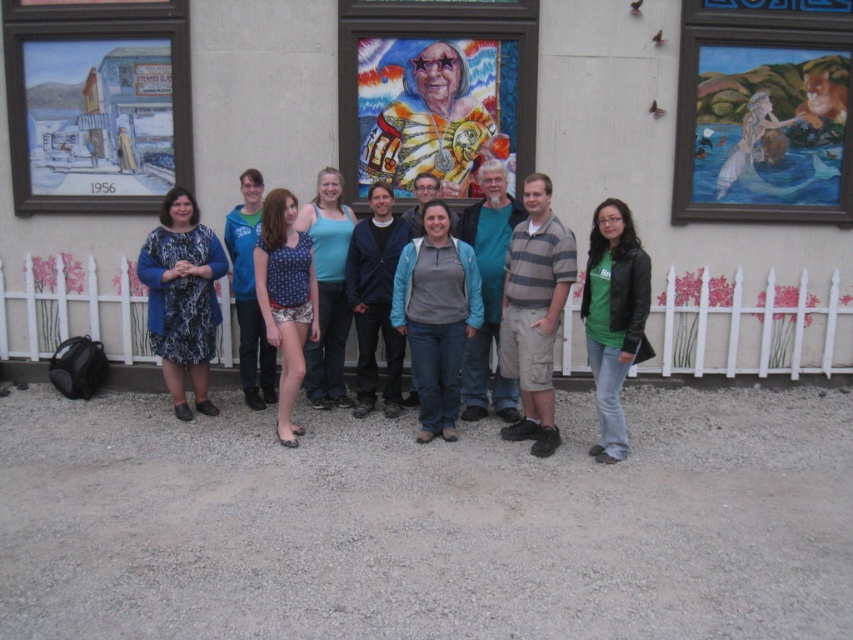
Looking at this image, is blue printed shorts at center below blue fabric tank top at center?

Indeed, blue printed shorts at center is positioned under blue fabric tank top at center.

Who is more distant from viewer, (283, 404) or (328, 268)?

Positioned behind is point (328, 268).

Identify the location of blue printed shorts at center. (285, 298).

Where is `blue printed shorts at center`? The height and width of the screenshot is (640, 853). blue printed shorts at center is located at coordinates (285, 298).

Is point (395, 320) positioned after point (332, 380)?

No, (395, 320) is in front of (332, 380).

Is matte gray sweater at center wider than blue fabric tank top at center?

Indeed, matte gray sweater at center has a greater width compared to blue fabric tank top at center.

Does point (428, 364) come closer to viewer compared to point (323, 236)?

Yes, point (428, 364) is in front of point (323, 236).

Locate an element on the screen. This screenshot has width=853, height=640. matte gray sweater at center is located at coordinates (436, 316).

Which is below, green matte jacket at lower right or blue fabric tank top at center?

Positioned lower is green matte jacket at lower right.

Does point (606, 214) come farther from viewer compared to point (311, 362)?

No, it is in front of (311, 362).

This screenshot has width=853, height=640. What do you see at coordinates (614, 317) in the screenshot?
I see `green matte jacket at lower right` at bounding box center [614, 317].

The width and height of the screenshot is (853, 640). Find the location of `green matte jacket at lower right`. green matte jacket at lower right is located at coordinates (614, 317).